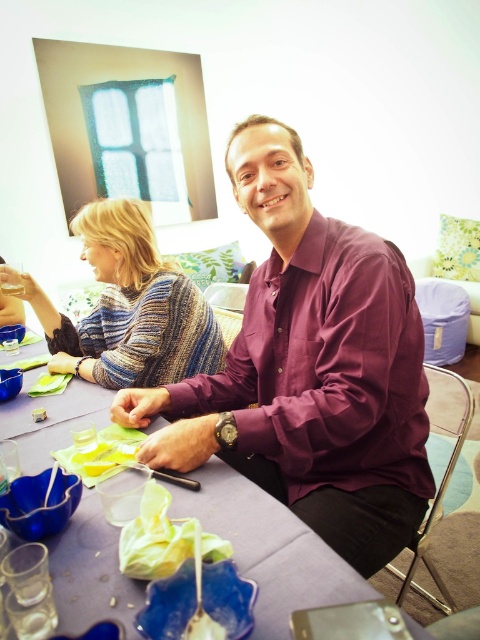
You are a guest at the event and want to place a small item on the purple matte shirt at center or the purple fabric table at center. Which surface is more suitable for placing an item?

The purple fabric table at center is more suitable for placing an item because the purple matte shirt at center is much taller than the table, meaning the shirt is elevated and likely not a flat surface.

You are at a party and want to greet the person wearing the purple matte shirt at center. Which direction should you walk to approach them from the knitted sweater at upper left?

You should walk towards the purple matte shirt at center because it is closer to you than the knitted sweater at upper left, so approaching from the direction of the knitted sweater at upper left would mean moving toward the center where the shirt is located.

You are a guest at this gathering and want to place your phone on the purple fabric table at center. However, you are currently holding your phone and standing in front of the purple matte shirt at center. Can you directly place your phone on the table without moving around any obstacles?

The purple fabric table at center is behind the purple matte shirt at center, so you can directly place your phone on the table without needing to move around any obstacles as the table is accessible from your current position in front of the shirt.